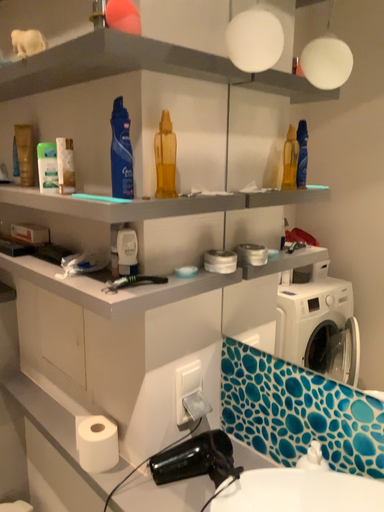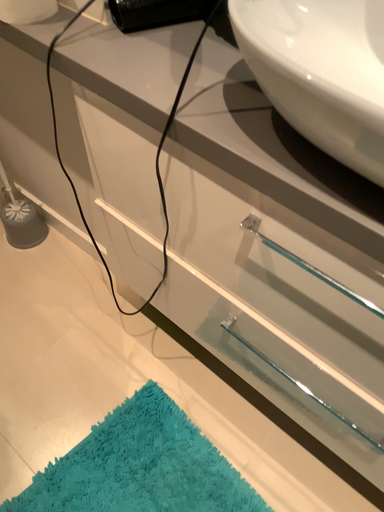
Question: Which way did the camera rotate in the video?

Choices:
 (A) rotated downward
 (B) rotated upward

Answer: (A)